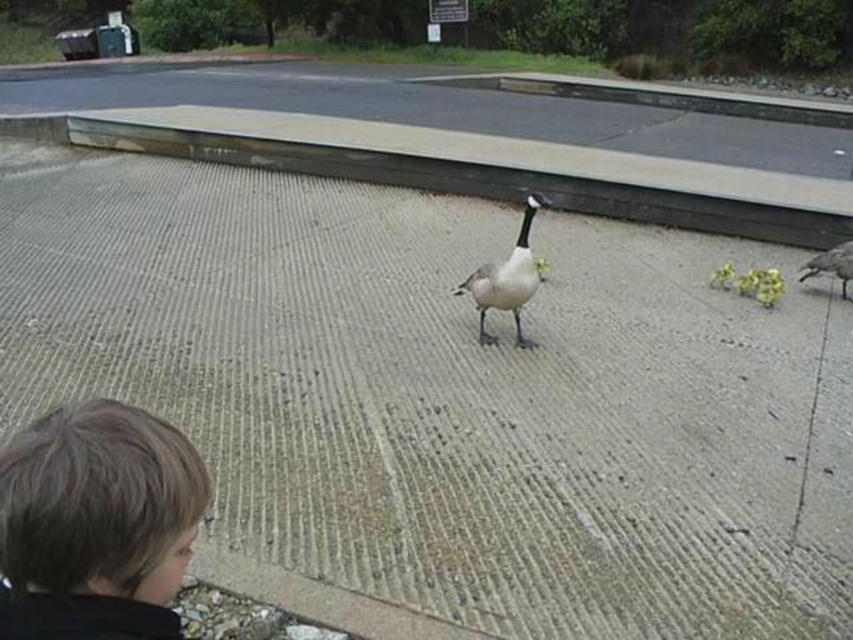
You are standing in the outdoor scene and want to take a photo of the Canada goose without the person blocking the view. The brown hair at lower left belongs to the observer. Based on their position, which direction should you move to ensure the person is no longer in your line of sight?

The brown hair at lower left is located at point (96, 524), so moving to the right or left away from that position would help avoid the person blocking the view.

You are a photographer trying to capture a clear shot of the gray matte goose at right while avoiding the brown hair at lower left. Based on their heights, which object would you need to adjust your camera angle to avoid blocking the view of the goose?

The brown hair at lower left has a lesser height compared to the gray matte goose at right. To avoid blocking the view of the goose, you can lower your camera angle slightly since the brown hair is shorter and less likely to obstruct the taller goose.

You are standing at the point labeled point (x=816, y=273) and want to walk towards the Canada goose on the concrete surface. Which direction should you move relative to the point labeled point (x=473, y=285)?

You should move towards the point labeled point (x=473, y=285) because it is closer to the Canada goose on the concrete surface than your current position at point (x=816, y=273).